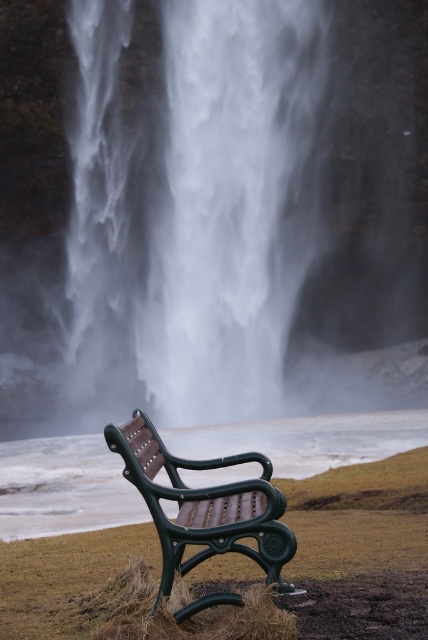
You are a visitor sitting on the bench in the scene. You notice the white misty waterfall at center and the translucent mist at bench center. Which mist is closer to you?

The translucent mist at bench center is closer to you because the white misty waterfall at center is positioned over it, meaning the waterfall is further away.

You are planning to sit on the green plastic bench at lower center to enjoy the waterfall view. However, you notice the translucent mist at bench center. Will the mist block your view of the waterfall when sitting on the bench?

The translucent mist at bench center has a larger width than the green plastic bench at lower center. Since the mist is wider, it may obstruct your view of the waterfall when sitting on the bench.

You are sitting on the green plastic bench at lower center and looking towards the waterfall. Which side of the bench do you see the translucent mist at bench center on?

The translucent mist at bench center is to the right of the green plastic bench at lower center, so you would see it on your right side when facing the waterfall.